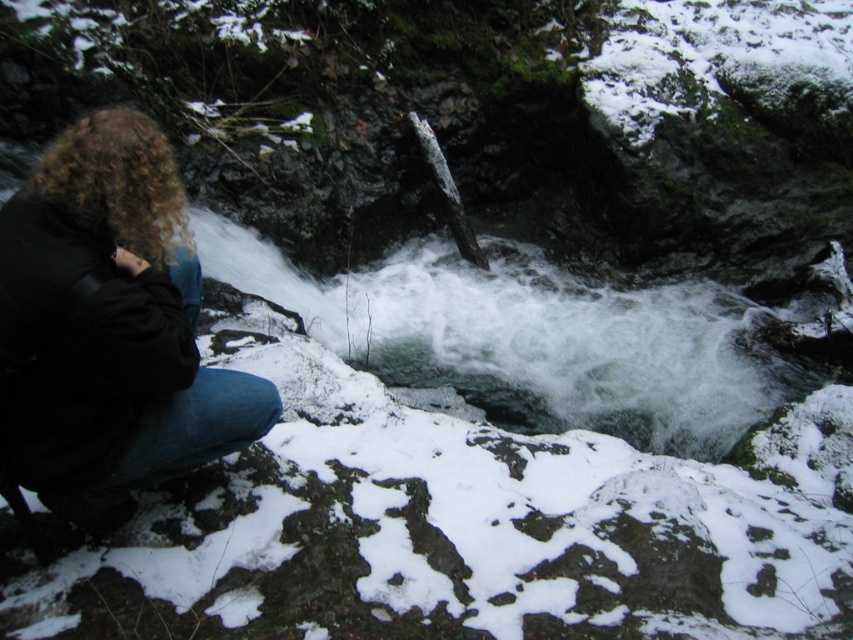
You are a hiker trying to decide whether to sit on the black leather jacket at left or the white frothy water at center. Which surface is safer for sitting?

The black leather jacket at left is thinner than the white frothy water at center, so sitting on the white frothy water at center would be safer because it provides a more stable surface.